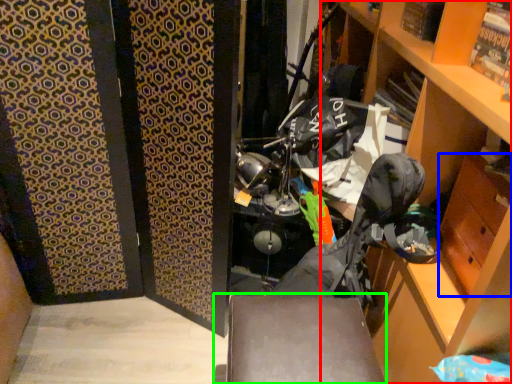
Question: Which is nearer to the cabinetry (highlighted by a red box)? drawer (highlighted by a blue box) or furniture (highlighted by a green box).

Choices:
 (A) drawer
 (B) furniture

Answer: (A)